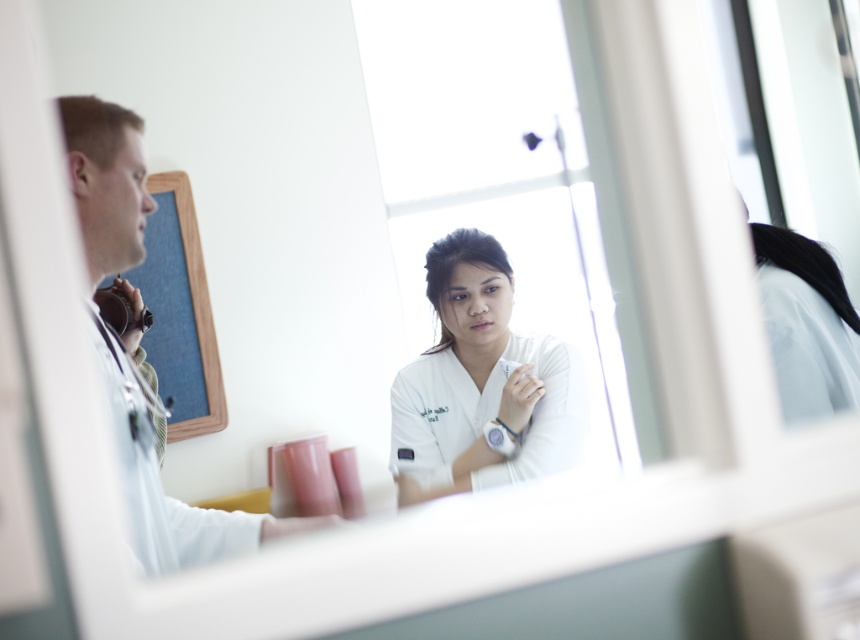
Question: Is white smooth uniform at center below white smooth stethoscope at left?

Choices:
 (A) no
 (B) yes

Answer: (B)

Question: Does white smooth uniform at center have a smaller size compared to white smooth stethoscope at left?

Choices:
 (A) yes
 (B) no

Answer: (A)

Question: Among these points, which one is farthest from the camera?

Choices:
 (A) (556, 417)
 (B) (152, 198)

Answer: (B)

Question: Among these points, which one is farthest from the camera?

Choices:
 (A) (105, 156)
 (B) (482, 360)

Answer: (B)

Question: Is the position of white smooth uniform at center more distant than that of white smooth stethoscope at left?

Choices:
 (A) yes
 (B) no

Answer: (A)